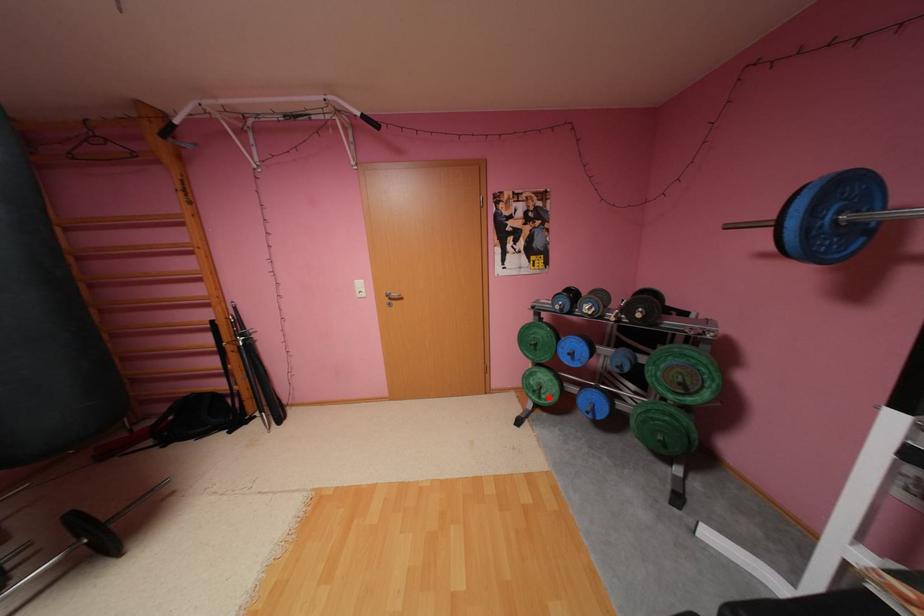
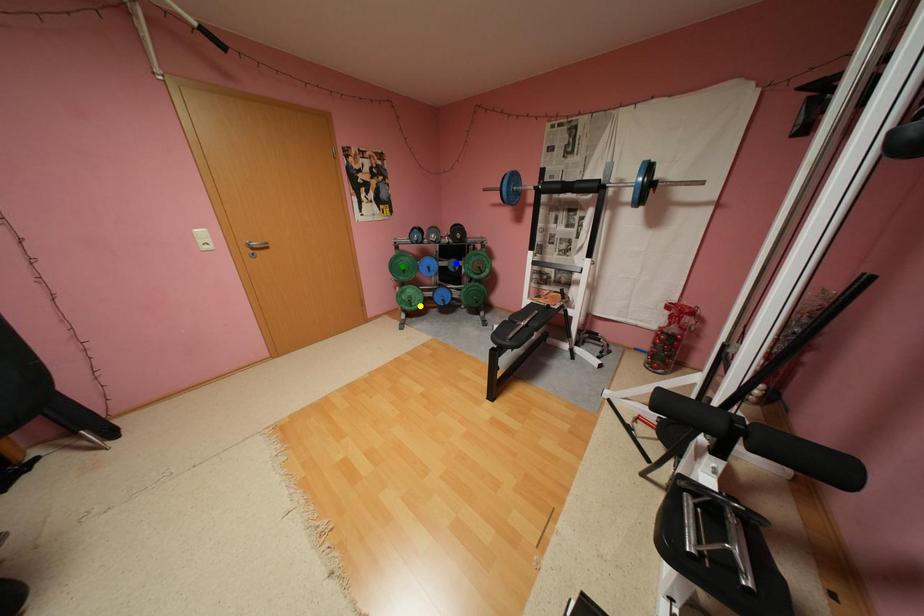
Question: I am providing you with two images of the same scene from different viewpoints. A red point is marked on the first image. You are given multiple points on the second image. Which point in image 2 represents the same 3d spot as the red point in image 1?

Choices:
 (A) yellow point
 (B) green point
 (C) blue point

Answer: (A)